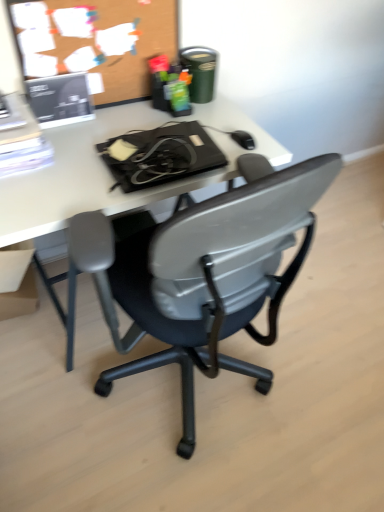
Question: Does black plastic chair at center touch matte cardboard box at lower left?

Choices:
 (A) no
 (B) yes

Answer: (A)

Question: From a real-world perspective, is black plastic chair at center below matte cardboard box at lower left?

Choices:
 (A) no
 (B) yes

Answer: (B)

Question: From the image's perspective, is black plastic chair at center on matte cardboard box at lower left?

Choices:
 (A) no
 (B) yes

Answer: (A)

Question: Is black plastic chair at center far away from matte cardboard box at lower left?

Choices:
 (A) no
 (B) yes

Answer: (A)

Question: Can you confirm if black plastic chair at center is wider than matte cardboard box at lower left?

Choices:
 (A) no
 (B) yes

Answer: (B)

Question: Could you tell me if black plastic chair at center is turned towards matte cardboard box at lower left?

Choices:
 (A) no
 (B) yes

Answer: (A)

Question: Would you say matte cardboard box at lower left is a long distance from wooden bulletin board at upper left?

Choices:
 (A) no
 (B) yes

Answer: (A)

Question: Is matte cardboard box at lower left closer to the viewer compared to wooden bulletin board at upper left?

Choices:
 (A) no
 (B) yes

Answer: (A)

Question: Could you tell me if matte cardboard box at lower left is facing wooden bulletin board at upper left?

Choices:
 (A) yes
 (B) no

Answer: (B)

Question: From a real-world perspective, does matte cardboard box at lower left sit lower than wooden bulletin board at upper left?

Choices:
 (A) yes
 (B) no

Answer: (A)

Question: Is matte cardboard box at lower left wider than wooden bulletin board at upper left?

Choices:
 (A) no
 (B) yes

Answer: (B)

Question: From a real-world perspective, is matte cardboard box at lower left physically above wooden bulletin board at upper left?

Choices:
 (A) yes
 (B) no

Answer: (B)

Question: Is matte cardboard box at lower left positioned before white plastic desk at center?

Choices:
 (A) no
 (B) yes

Answer: (A)